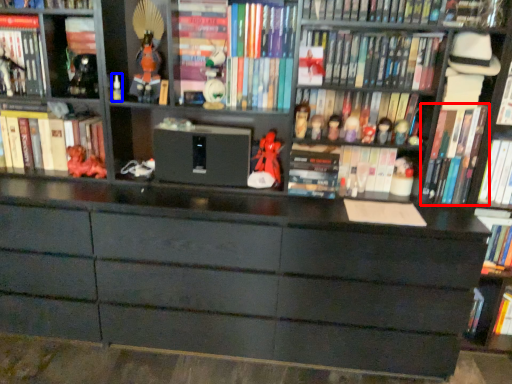
Question: Which point is further to the camera, book (highlighted by a red box) or toy (highlighted by a blue box)?

Choices:
 (A) book
 (B) toy

Answer: (B)